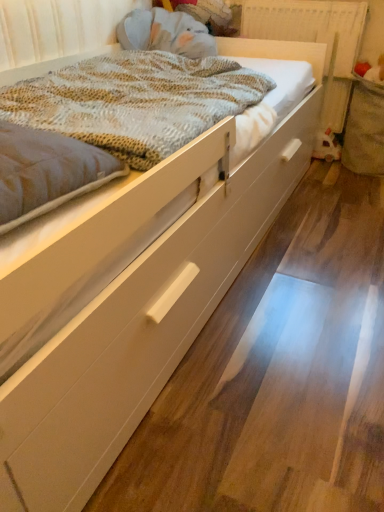
Question: Should I look upward or downward to see textured beige blanket at center?

Choices:
 (A) down
 (B) up

Answer: (B)